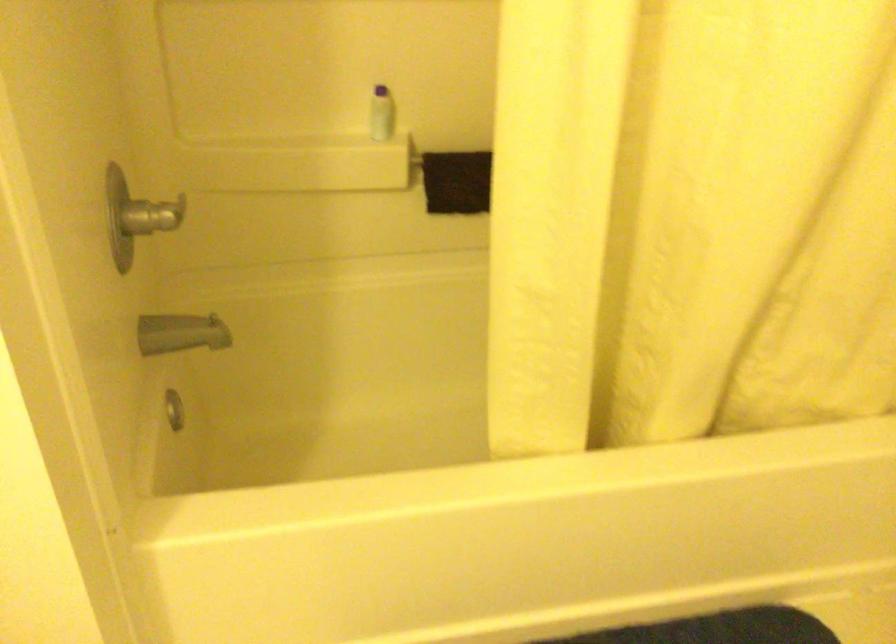
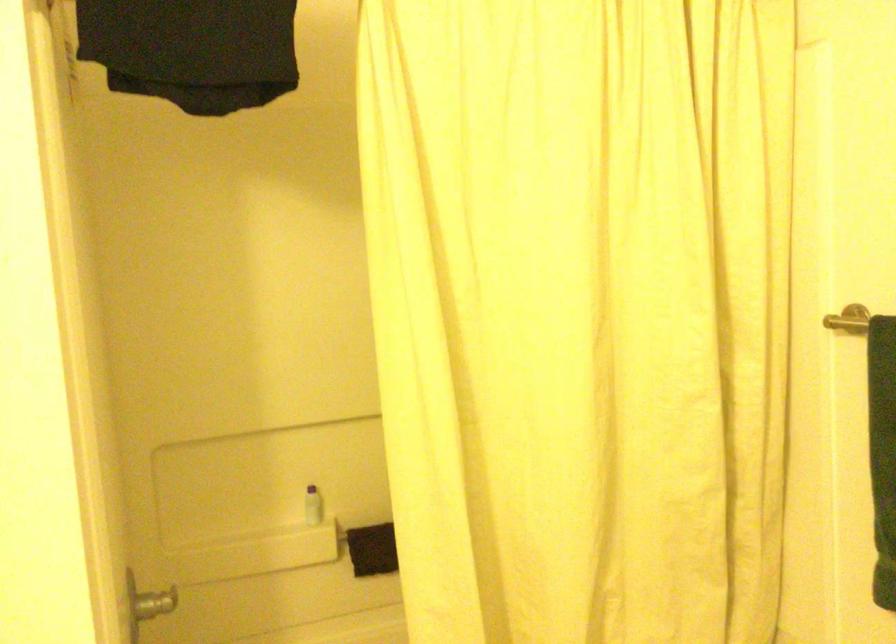
Question: The images are taken continuously from a first-person perspective. In which direction is your viewpoint rotating?

Choices:
 (A) Left
 (B) Right
 (C) Up
 (D) Down

Answer: (C)